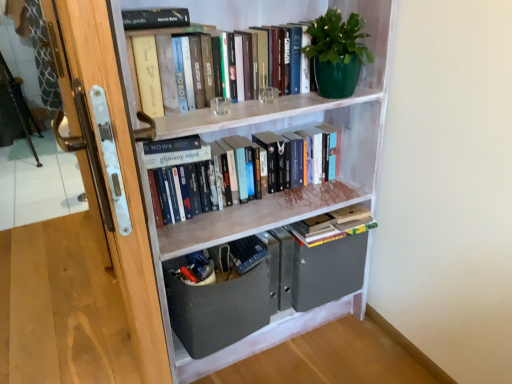
Question: Is hardcover books at center, placed as the 2th book when sorted from top to bottom, facing towards green matte pot at upper right?

Choices:
 (A) yes
 (B) no

Answer: (B)

Question: Is hardcover books at center, placed as the 2th book when sorted from top to bottom, positioned with its back to green matte pot at upper right?

Choices:
 (A) yes
 (B) no

Answer: (B)

Question: From the image's perspective, is hardcover books at center, positioned as the 2th book in bottom-to-top order, over green matte pot at upper right?

Choices:
 (A) no
 (B) yes

Answer: (A)

Question: Is the depth of hardcover books at center, positioned as the 2th book in bottom-to-top order, less than that of green matte pot at upper right?

Choices:
 (A) no
 (B) yes

Answer: (A)

Question: Is hardcover books at center, placed as the 2th book when sorted from top to bottom, thinner than green matte pot at upper right?

Choices:
 (A) yes
 (B) no

Answer: (A)

Question: From a real-world perspective, is wooden door handle at left above or below hardcover books at upper center, which is the first book from top to bottom?

Choices:
 (A) above
 (B) below

Answer: (B)

Question: Considering the positions of wooden door handle at left and hardcover books at upper center, which is the first book from top to bottom, in the image, is wooden door handle at left bigger or smaller than hardcover books at upper center, which is the first book from top to bottom,?

Choices:
 (A) big
 (B) small

Answer: (A)

Question: Is wooden door handle at left taller or shorter than hardcover books at upper center, arranged as the 3th book when ordered from the bottom?

Choices:
 (A) short
 (B) tall

Answer: (B)

Question: Is wooden door handle at left spatially inside hardcover books at upper center, arranged as the 3th book when ordered from the bottom, or outside of it?

Choices:
 (A) outside
 (B) inside

Answer: (A)

Question: Does point (224, 296) appear closer or farther from the camera than point (268, 168)?

Choices:
 (A) farther
 (B) closer

Answer: (B)

Question: From their relative heights in the image, would you say matte gray drawer at lower center is taller or shorter than hardcover books at center, placed as the 2th book when sorted from top to bottom?

Choices:
 (A) tall
 (B) short

Answer: (A)

Question: In terms of size, does matte gray drawer at lower center appear bigger or smaller than hardcover books at center, placed as the 2th book when sorted from top to bottom?

Choices:
 (A) big
 (B) small

Answer: (A)

Question: Is matte gray drawer at lower center spatially inside hardcover books at center, positioned as the 2th book in bottom-to-top order, or outside of it?

Choices:
 (A) outside
 (B) inside

Answer: (A)

Question: Considering the positions of white painted wood bookcase at upper center and hardcover books at upper center, which is the first book from top to bottom, in the image, is white painted wood bookcase at upper center wider or thinner than hardcover books at upper center, which is the first book from top to bottom,?

Choices:
 (A) thin
 (B) wide

Answer: (B)

Question: From the image's perspective, is white painted wood bookcase at upper center located above or below hardcover books at upper center, which is the first book from top to bottom?

Choices:
 (A) below
 (B) above

Answer: (A)